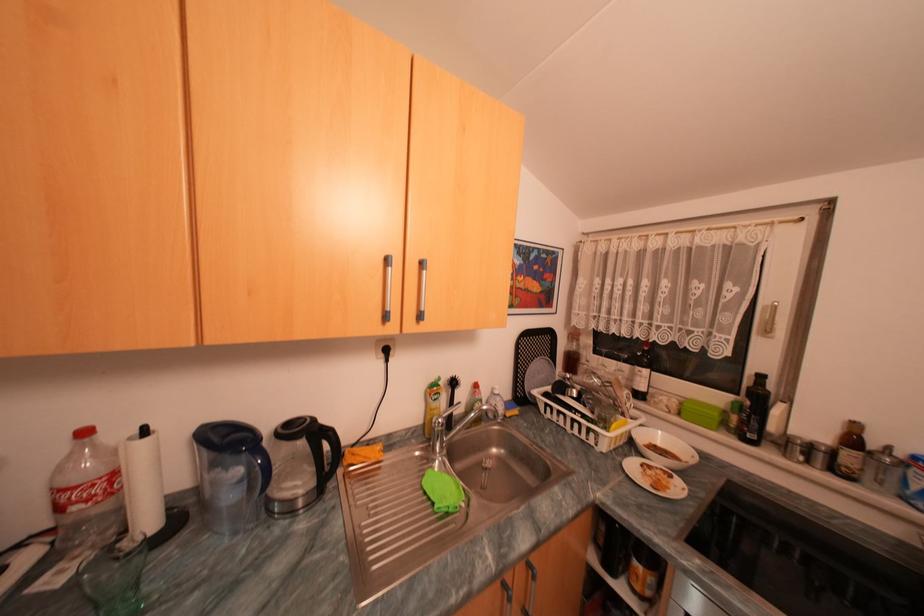
You are a GUI agent. You are given a task and a screenshot of the screen. Output one action in this format:
    pyautogui.click(x=<x>, y=<y>)
    Task: Click on the paper towel roll
    The image size is (924, 616).
    Given the screenshot: What is the action you would take?
    pyautogui.click(x=142, y=482)